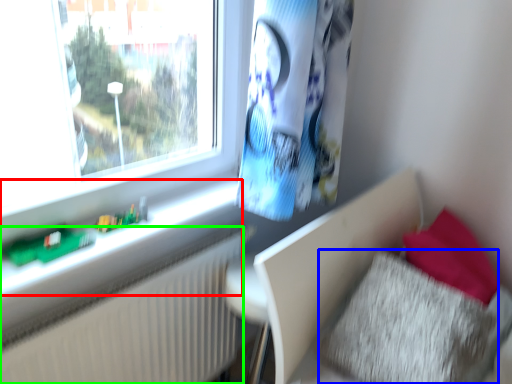
Question: Which object is positioned closest to window sill (highlighted by a red box)? Select from pillow (highlighted by a blue box) and radiator (highlighted by a green box).

Choices:
 (A) pillow
 (B) radiator

Answer: (B)